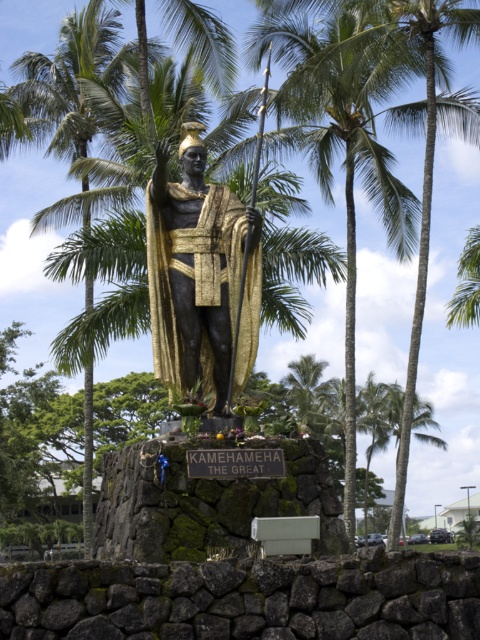
Does green leafy palm tree at center have a larger size compared to green leafy palm tree at left?

No.

Is green leafy palm tree at center thinner than green leafy palm tree at left?

Indeed, green leafy palm tree at center has a lesser width compared to green leafy palm tree at left.

Locate an element on the screen. Image resolution: width=480 pixels, height=640 pixels. green leafy palm tree at center is located at coordinates (349, 134).

Is green leafy palm tree at center to the left of bronze statue at center from the viewer's perspective?

Incorrect, green leafy palm tree at center is not on the left side of bronze statue at center.

Who is positioned more to the left, green leafy palm tree at center or bronze statue at center?

Positioned to the left is bronze statue at center.

Which is in front, point (305, 60) or point (168, 381)?

Positioned in front is point (168, 381).

The height and width of the screenshot is (640, 480). In order to click on green leafy palm tree at center in this screenshot , I will do point(349,134).

Which is more to the left, bronze statue at center or green leafy palm tree at left?

green leafy palm tree at left

Where is `bronze statue at center`? bronze statue at center is located at coordinates (201, 275).

Find the location of a particular element. Image resolution: width=480 pixels, height=640 pixels. bronze statue at center is located at coordinates (201, 275).